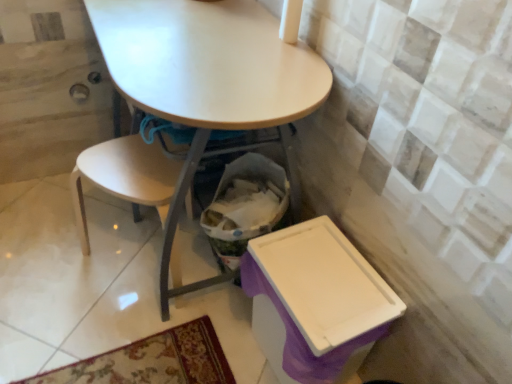
Locate an element on the screen. vacant area in front of light wood chair at lower left is located at coordinates (112, 341).